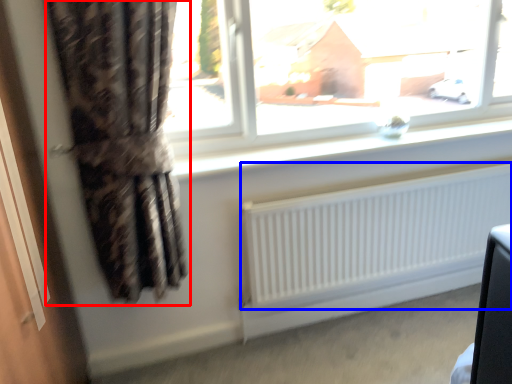
Question: Among these objects, which one is farthest to the camera, curtain (highlighted by a red box) or radiator (highlighted by a blue box)?

Choices:
 (A) curtain
 (B) radiator

Answer: (B)